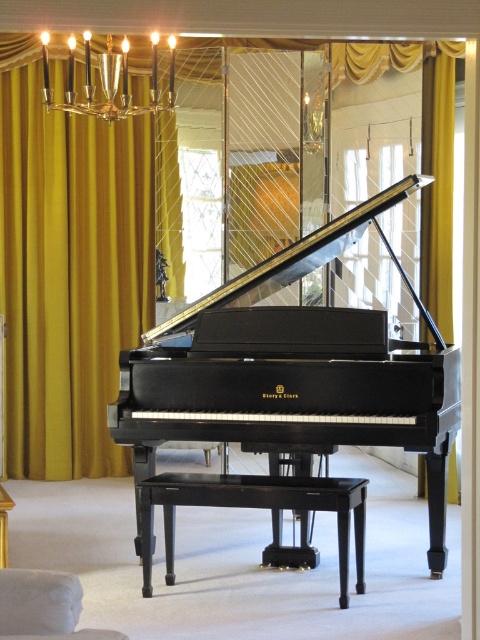
You are a professional interior designer planning to place a large painting between the yellow velvet curtain at upper left and the gold velvet curtain at left. Which curtain should the painting be placed closer to for balance?

The yellow velvet curtain at upper left is bigger than the gold velvet curtain at left, so placing the painting closer to the gold velvet curtain at left would help balance the visual weight between the two curtains.

You are a guest standing in the room and want to sit on the black polished piano at center. To avoid bumping into the gold metallic chandelier at upper center, which direction should you move relative to the chandelier?

The black polished piano at center is to the right of the gold metallic chandelier at upper center, so you should move to the left relative to the chandelier to avoid bumping into it.

You are a decorator assessing the room layout. You need to decide which object, the yellow velvet curtain at upper left or the gold metallic chandelier at upper center, requires a taller support structure. Based on the scene, which one needs a taller support?

The yellow velvet curtain at upper left requires a taller support structure because it is taller than the gold metallic chandelier at upper center.